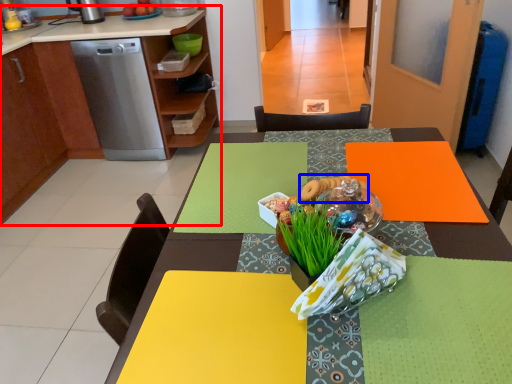
Question: Which point is further to the camera, cabinetry (highlighted by a red box) or food (highlighted by a blue box)?

Choices:
 (A) cabinetry
 (B) food

Answer: (A)